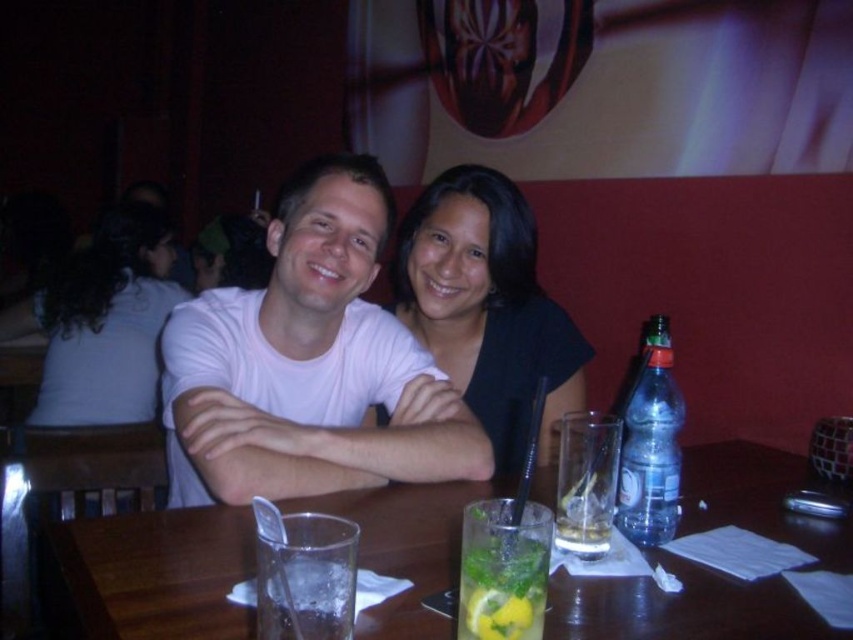
Question: Does transparent glass at center lie behind white fabric shirt at upper left?

Choices:
 (A) yes
 (B) no

Answer: (B)

Question: Which of the following is the farthest from the observer?

Choices:
 (A) transparent glass at center
 (B) black matte shirt at center

Answer: (B)

Question: Which of the following is the closest to the observer?

Choices:
 (A) green leafy drink at center
 (B) clear plastic bottle at right
 (C) black matte shirt at center

Answer: (A)

Question: Which of the following is the farthest from the observer?

Choices:
 (A) (688, 634)
 (B) (416, 225)
 (C) (467, 582)

Answer: (B)

Question: Can you confirm if white fabric shirt at upper left is positioned below green leafy drink at center?

Choices:
 (A) no
 (B) yes

Answer: (A)

Question: Where is transparent glass at center located in relation to black matte shirt at center in the image?

Choices:
 (A) left
 (B) right

Answer: (B)